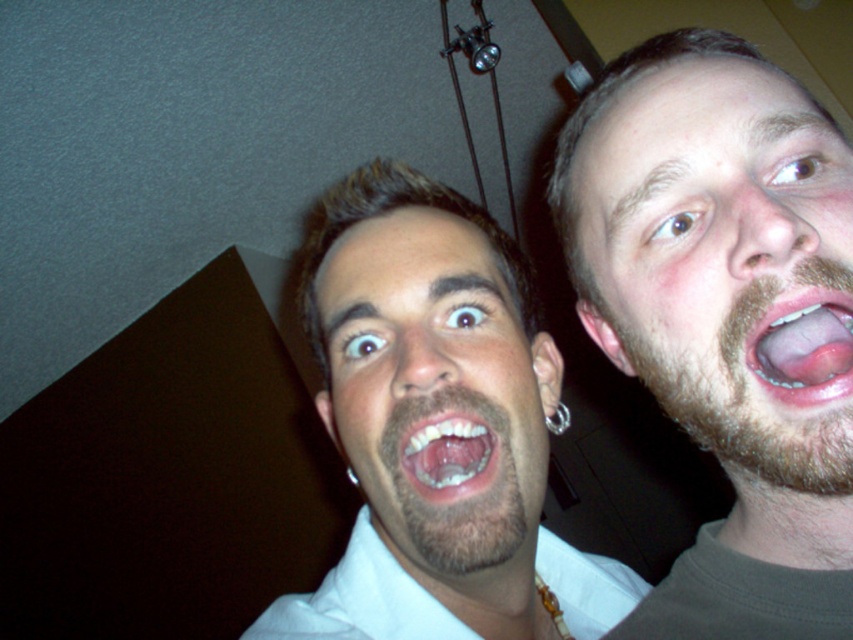
Measure the distance from pink glossy tongue at center to white glossy teeth at center.

pink glossy tongue at center and white glossy teeth at center are 12.75 centimeters apart from each other.

Does pink glossy tongue at center appear on the right side of white glossy teeth at center?

Indeed, pink glossy tongue at center is positioned on the right side of white glossy teeth at center.

Locate an element on the screen. pink glossy tongue at center is located at coordinates (796, 339).

The width and height of the screenshot is (853, 640). Find the location of `pink glossy tongue at center`. pink glossy tongue at center is located at coordinates (796, 339).

Is beige facial hair at upper right wider than white glossy teeth at center?

Correct, the width of beige facial hair at upper right exceeds that of white glossy teeth at center.

Does beige facial hair at upper right have a lesser height compared to white glossy teeth at center?

No, beige facial hair at upper right is not shorter than white glossy teeth at center.

Describe the element at coordinates (722, 260) in the screenshot. I see `beige facial hair at upper right` at that location.

You are a GUI agent. You are given a task and a screenshot of the screen. Output one action in this format:
    pyautogui.click(x=<x>, y=<y>)
    Task: Click on the beige facial hair at upper right
    The height and width of the screenshot is (640, 853).
    Given the screenshot: What is the action you would take?
    pyautogui.click(x=722, y=260)

Can you confirm if brownhairman at center is positioned to the right of white glossy teeth at center?

Correct, you'll find brownhairman at center to the right of white glossy teeth at center.

The width and height of the screenshot is (853, 640). Describe the element at coordinates (436, 392) in the screenshot. I see `brownhairman at center` at that location.

Locate an element on the screen. This screenshot has height=640, width=853. brownhairman at center is located at coordinates (436, 392).